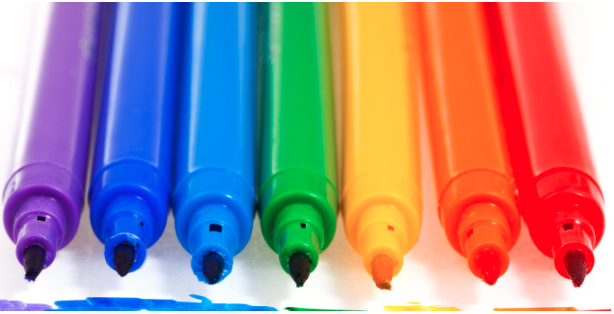
Locate an element on the screen. markers is located at coordinates (42, 194), (131, 194), (199, 196), (277, 199), (373, 200), (467, 200), (575, 200).